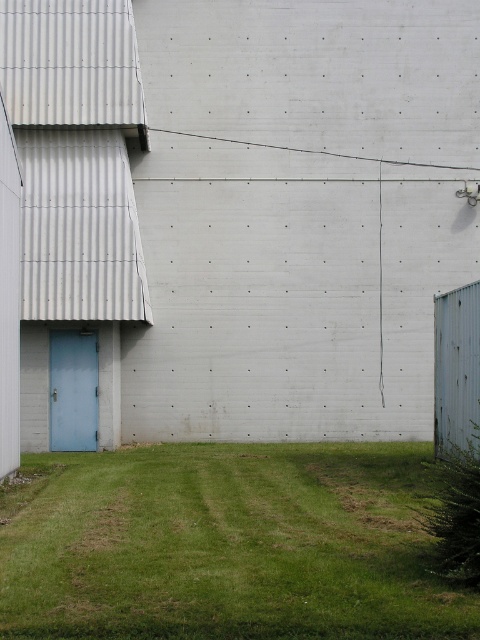
You are standing in front of the concrete wall and want to know which of the two points, point (474, 611) or point (60, 417), is closer to you. Can you determine this based on the scene?

Point (474, 611) is closer to the viewer than point (60, 417).

You are a gardener who needs to mow the lawn. You see the green grass at lower center and the light blue painted wood door at left. Which area should you focus on first for mowing?

The gardener should focus on mowing the green grass at lower center first since it has a larger size compared to the light blue painted wood door at left, meaning there is more grass to mow there.